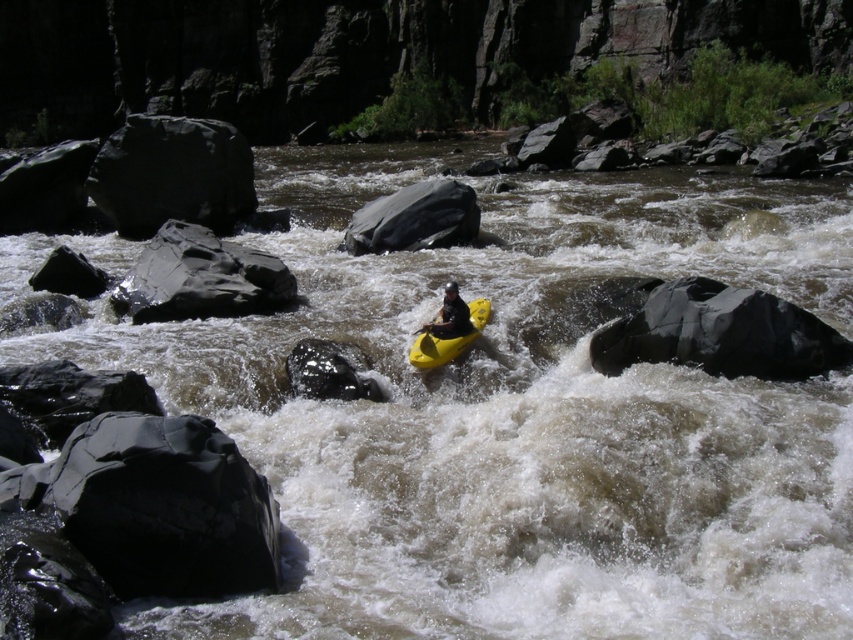
Question: Is smooth gray rock at left bigger than yellow matte kayak at center?

Choices:
 (A) yes
 (B) no

Answer: (A)

Question: Estimate the real-world distances between objects in this image. Which object is farther from the yellow rubber paddle at center?

Choices:
 (A) yellow matte kayak at center
 (B) smooth gray rock at center
 (C) black rubber boulder at lower right
 (D) yellow rubber canoe at center

Answer: (B)

Question: Among these points, which one is farthest from the camera?

Choices:
 (A) (434, 317)
 (B) (404, 221)

Answer: (B)

Question: Where is smooth gray rock at left located in relation to smooth gray rock at center in the image?

Choices:
 (A) left
 (B) right

Answer: (A)

Question: Can you confirm if black rubber boulder at lower right is positioned to the right of yellow rubber paddle at center?

Choices:
 (A) yes
 (B) no

Answer: (A)

Question: Considering the real-world distances, which object is farthest from the yellow matte kayak at center?

Choices:
 (A) black rubber boulder at lower right
 (B) smooth gray rock at center
 (C) yellow rubber canoe at center
 (D) smooth gray rock at left

Answer: (B)